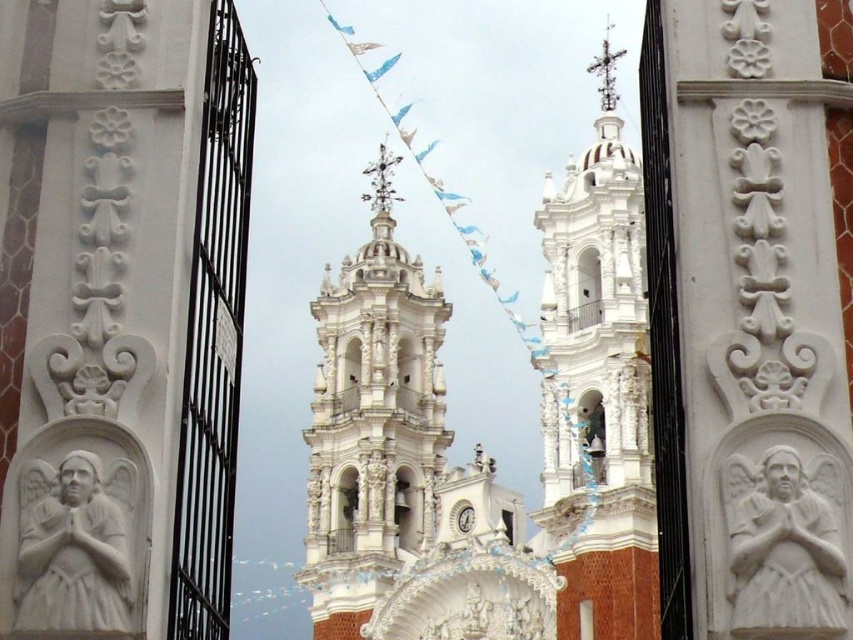
Question: Which object is positioned closest to the white stone angel at center?

Choices:
 (A) white stone angel at left
 (B) white ornate tower at center

Answer: (A)

Question: Is white carved stone tower at center above white stone angel at left?

Choices:
 (A) no
 (B) yes

Answer: (B)

Question: Which is farther from the white ornate tower at center?

Choices:
 (A) white stone angel at left
 (B) white stone angel at center

Answer: (B)

Question: Does white carved stone tower at center appear on the left side of white ornate tower at center?

Choices:
 (A) yes
 (B) no

Answer: (B)

Question: Can you confirm if white stone angel at center is positioned below white stone angel at left?

Choices:
 (A) yes
 (B) no

Answer: (B)

Question: Estimate the real-world distances between objects in this image. Which object is closer to the white stone angel at center?

Choices:
 (A) white carved stone tower at center
 (B) white stone angel at left

Answer: (B)